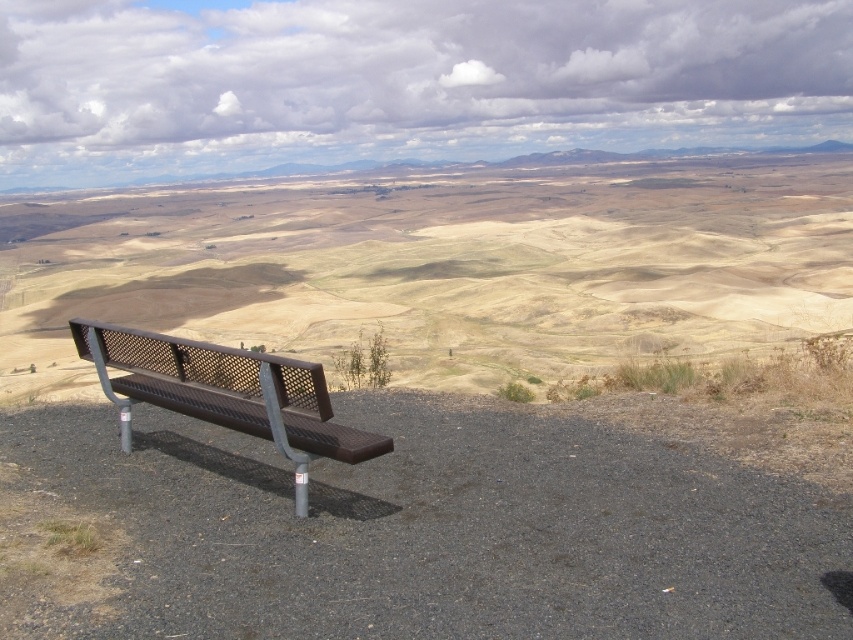
Does brown textured bench at lower left have a lesser height compared to brown metal bench at lower left?

No.

This screenshot has height=640, width=853. Describe the element at coordinates (444, 266) in the screenshot. I see `brown textured bench at lower left` at that location.

Which is behind, point (799, 234) or point (370, 449)?

The point (799, 234) is behind.

The image size is (853, 640). What are the coordinates of `brown textured bench at lower left` in the screenshot? It's located at (444, 266).